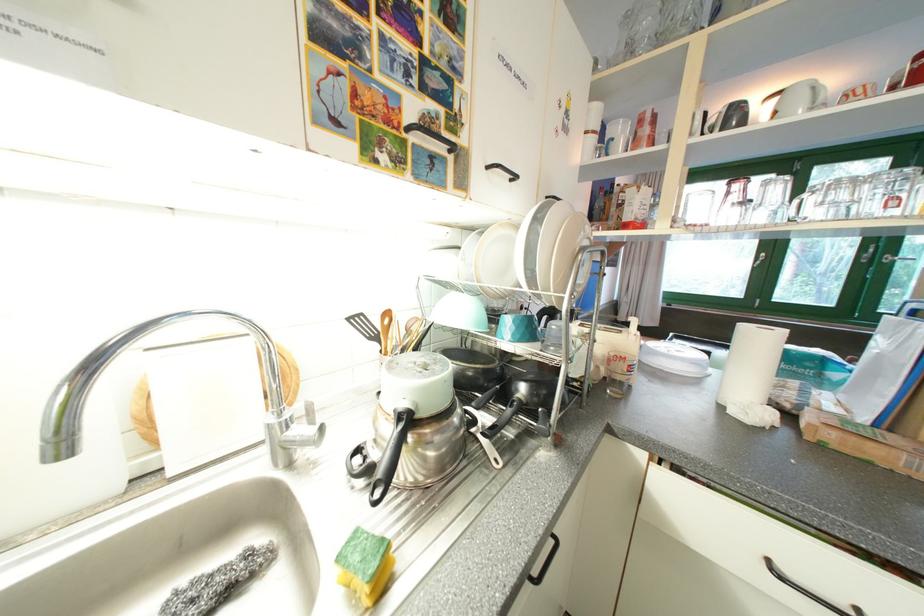
Where would you lift the black pan handle? Please return your answer as a coordinate pair (x, y).

(503, 418)